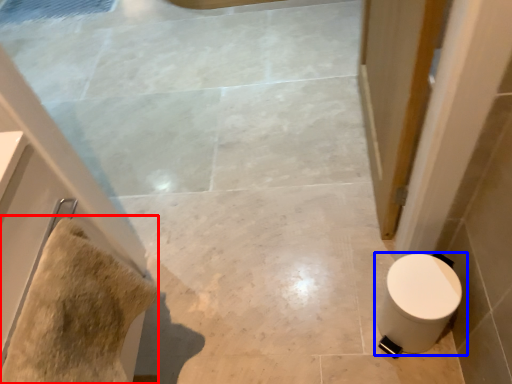
Question: Which object is closer to the camera taking this photo, material (highlighted by a red box) or toilet (highlighted by a blue box)?

Choices:
 (A) material
 (B) toilet

Answer: (A)